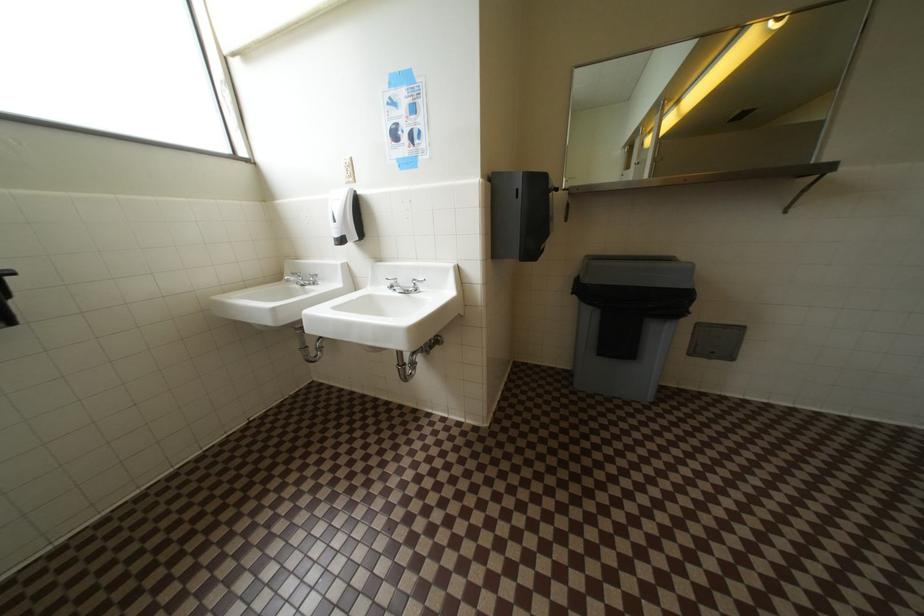
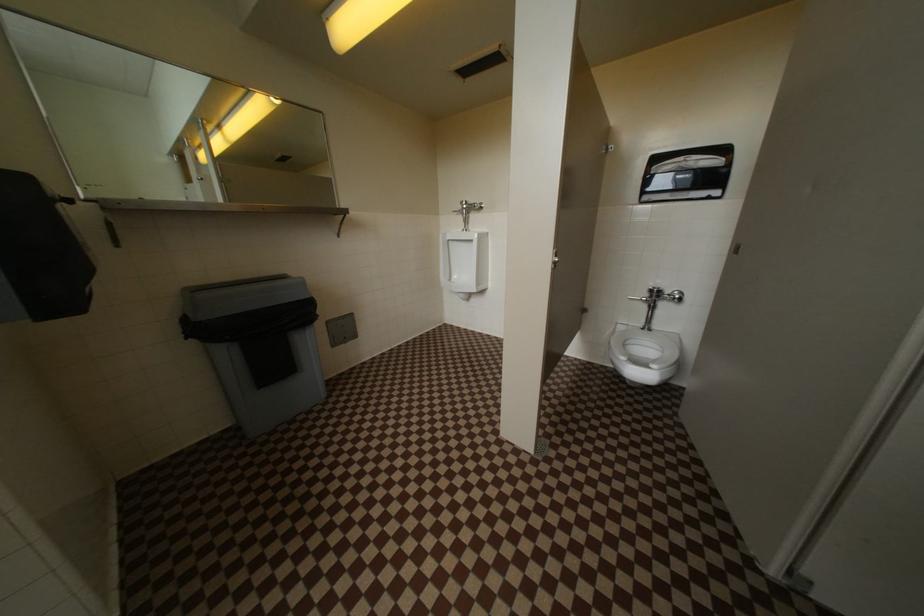
Question: The camera is either moving clockwise (left) or counter-clockwise (right) around the object. The first image is from the beginning of the video and the second image is from the end. Is the camera moving left or right when shooting the video?

Choices:
 (A) Left
 (B) Right

Answer: (A)